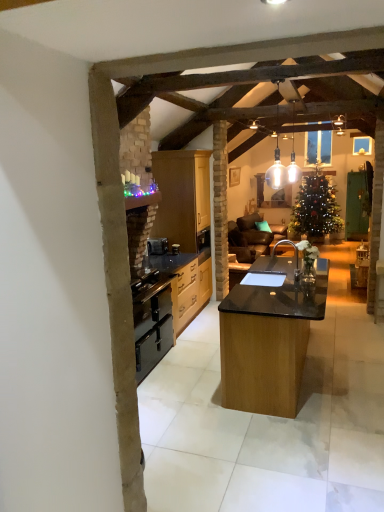
Question: Does black matte oven at center appear on the left side of black wood cabinets at center, the 2th cabinetry in the top-to-bottom sequence?

Choices:
 (A) yes
 (B) no

Answer: (A)

Question: Does black matte oven at center touch black wood cabinets at center, arranged as the first cabinetry when ordered from the bottom?

Choices:
 (A) yes
 (B) no

Answer: (B)

Question: From the image's perspective, does black matte oven at center appear higher than black wood cabinets at center, the 2th cabinetry in the top-to-bottom sequence?

Choices:
 (A) yes
 (B) no

Answer: (A)

Question: Is black wood cabinets at center, arranged as the first cabinetry when ordered from the bottom, a part of black matte oven at center?

Choices:
 (A) no
 (B) yes

Answer: (A)

Question: Is the position of black matte oven at center more distant than that of black wood cabinets at center, the 2th cabinetry in the top-to-bottom sequence?

Choices:
 (A) no
 (B) yes

Answer: (B)

Question: Is point [x=165, y=245] positioned closer to the camera than point [x=206, y=184]?

Choices:
 (A) closer
 (B) farther

Answer: (A)

Question: From a real-world perspective, is black matte oven at center physically located above or below matte wood cabinets at center, which appears as the 2th cabinetry when ordered from the bottom?

Choices:
 (A) above
 (B) below

Answer: (B)

Question: Would you say black matte oven at center is inside or outside matte wood cabinets at center, which is the 1th cabinetry in top-to-bottom order?

Choices:
 (A) outside
 (B) inside

Answer: (B)

Question: Would you say black matte oven at center is to the left or to the right of matte wood cabinets at center, which appears as the 2th cabinetry when ordered from the bottom, in the picture?

Choices:
 (A) left
 (B) right

Answer: (A)

Question: Considering their positions, is black matte oven at center located in front of or behind black matte sink at center?

Choices:
 (A) behind
 (B) front

Answer: (A)

Question: Is black matte oven at center wider or thinner than black matte sink at center?

Choices:
 (A) thin
 (B) wide

Answer: (A)

Question: Do you think black matte oven at center is within black matte sink at center, or outside of it?

Choices:
 (A) inside
 (B) outside

Answer: (B)

Question: In the image, is black matte oven at center on the left side or the right side of black matte sink at center?

Choices:
 (A) left
 (B) right

Answer: (A)

Question: Is black matte oven at center inside or outside of matte wood cabinets at center, which is the 1th cabinetry in top-to-bottom order?

Choices:
 (A) outside
 (B) inside

Answer: (A)

Question: Is black matte oven at center bigger or smaller than matte wood cabinets at center, which appears as the 2th cabinetry when ordered from the bottom?

Choices:
 (A) small
 (B) big

Answer: (A)